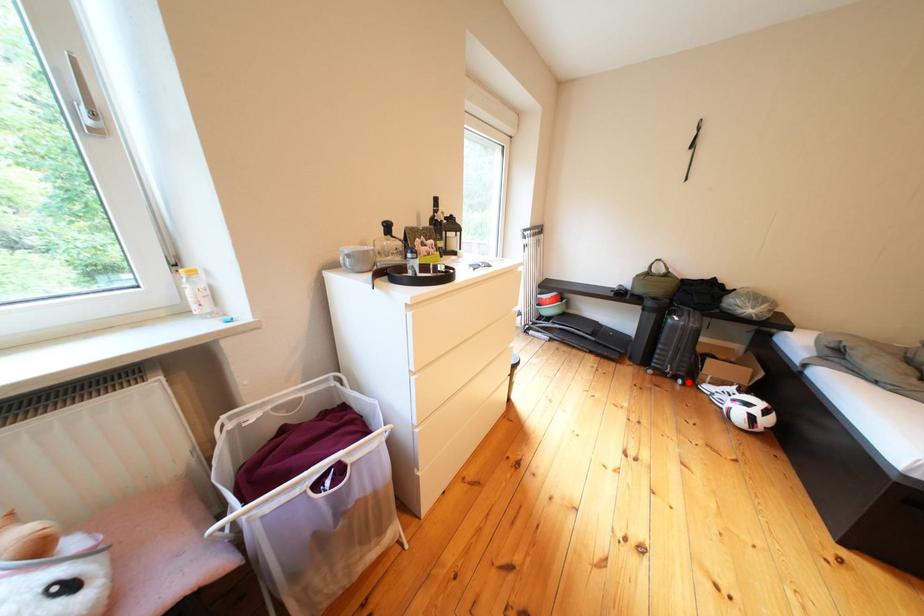
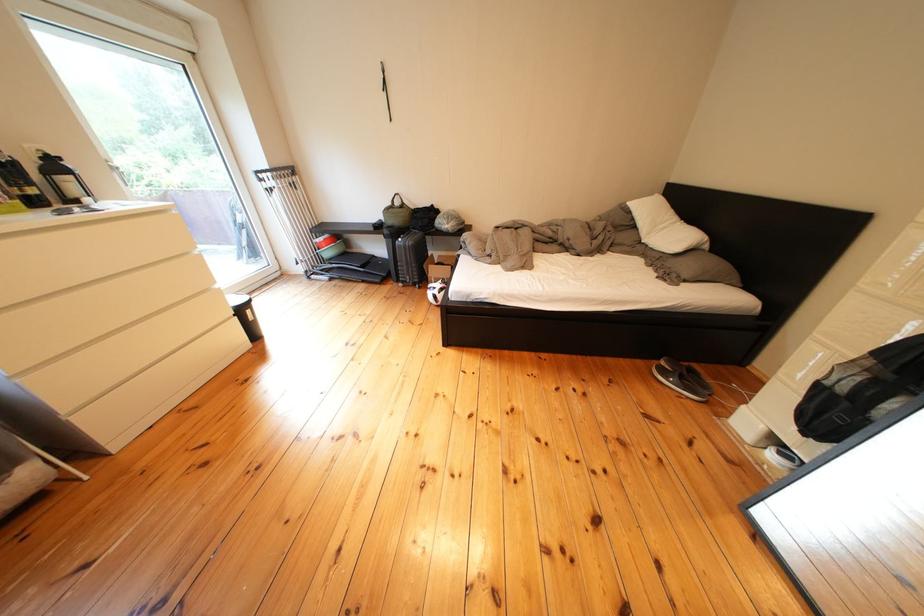
Question: I am providing you with two images of the same scene from different viewpoints. Image1 has a red point marked. In image2, the corresponding 3D location appears at what relative position? Reply with the corresponding letter.

Choices:
 (A) Closer
 (B) Farther

Answer: (B)